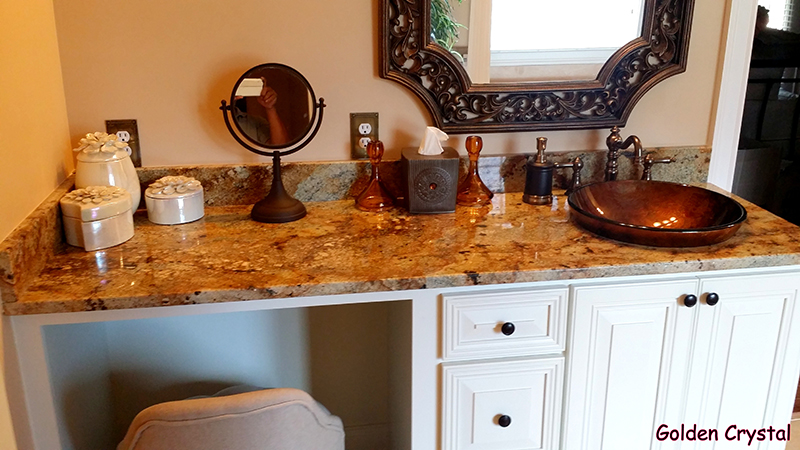
Locate an element on the screen. knobs is located at coordinates (688, 304), (714, 297), (517, 327).